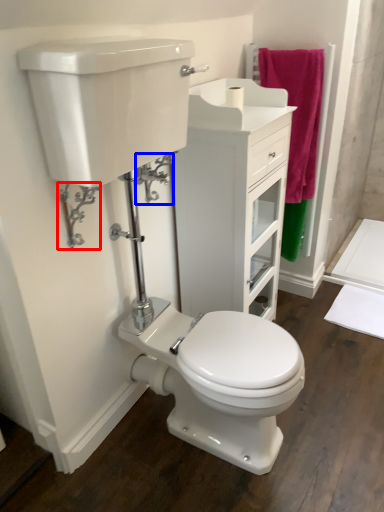
Question: Among these objects, which one is nearest to the camera, plumbing fixture (highlighted by a red box) or plumbing fixture (highlighted by a blue box)?

Choices:
 (A) plumbing fixture
 (B) plumbing fixture

Answer: (A)